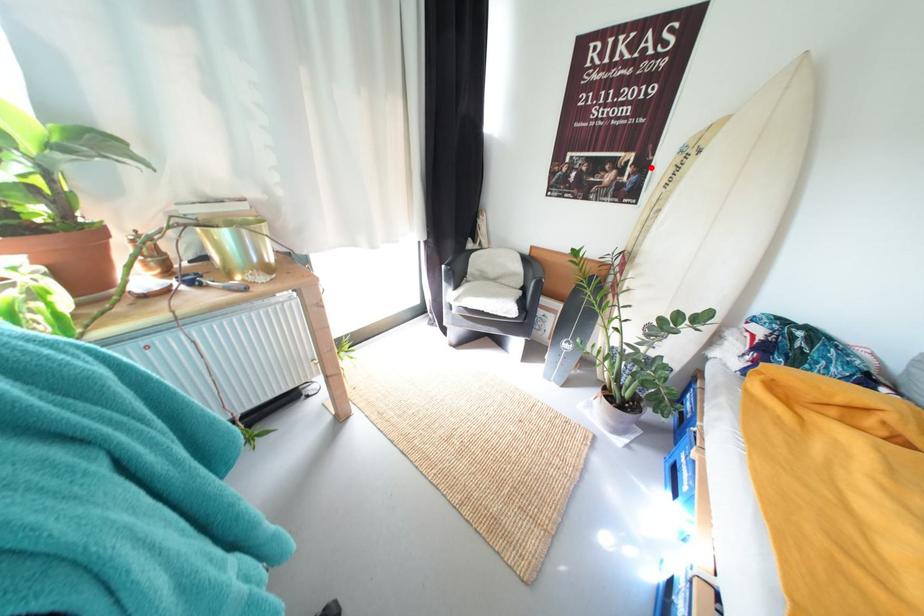
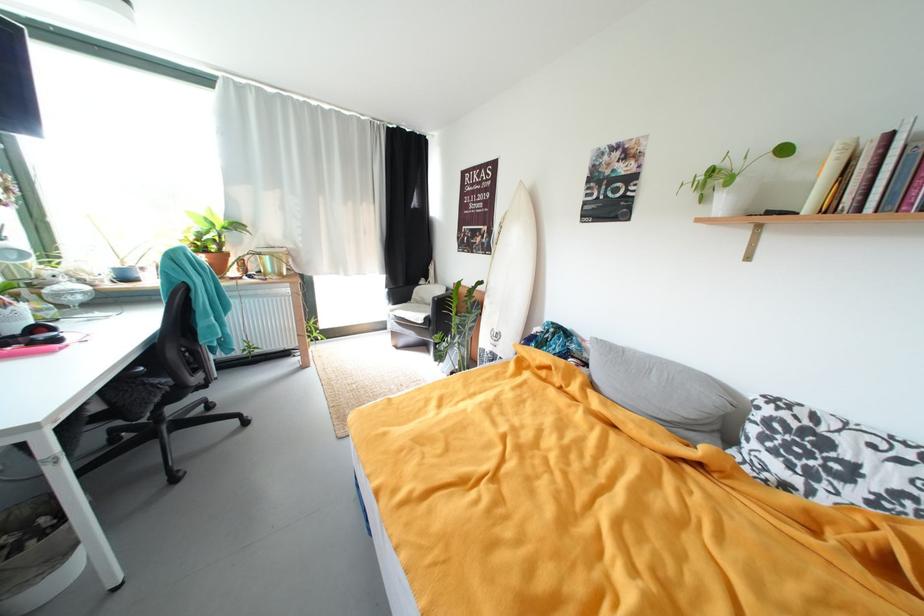
The point at the highlighted location is marked in the first image. Where is the corresponding point in the second image?

(497, 235)